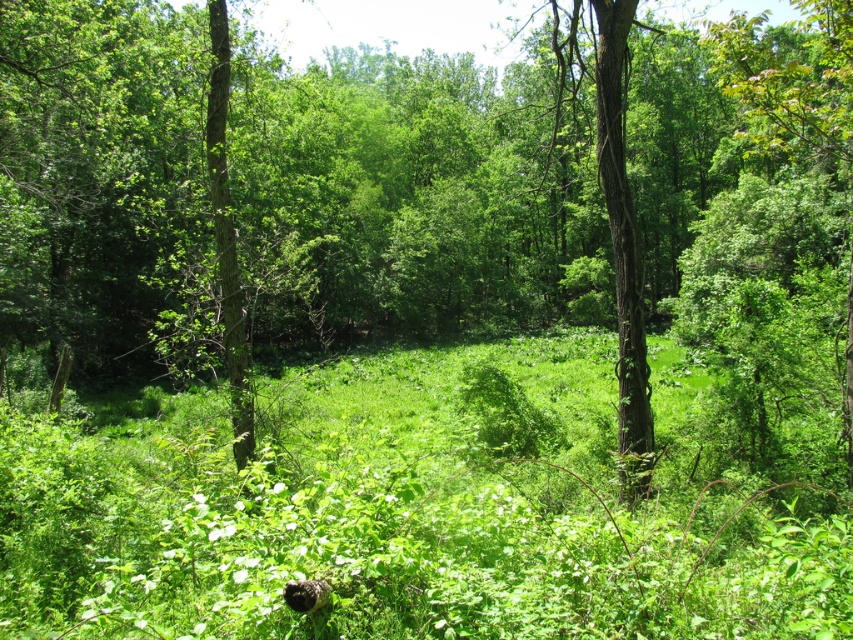
You are a photographer trying to capture a clear shot of the fluffy black cat at lower center. However, the green leafy grass at center is blocking your view. Can you adjust your position to see the cat without the grass obstructing the view?

The green leafy grass at center is taller than the fluffy black cat at lower center, so adjusting your position to a lower angle or moving closer might allow you to see the cat without the grass blocking the view.

You are a hiker who wants to walk through the forest. You notice the green leafy grass at center and the fluffy black cat at lower center. Which object is wider when viewed from above?

The green leafy grass at center is wider than the fluffy black cat at lower center.

You are standing in the forest and see a point marked at coordinates [422,506]. According to the scene description, what is located at that point?

The point at coordinates [422,506] marks green leafy grass at center.